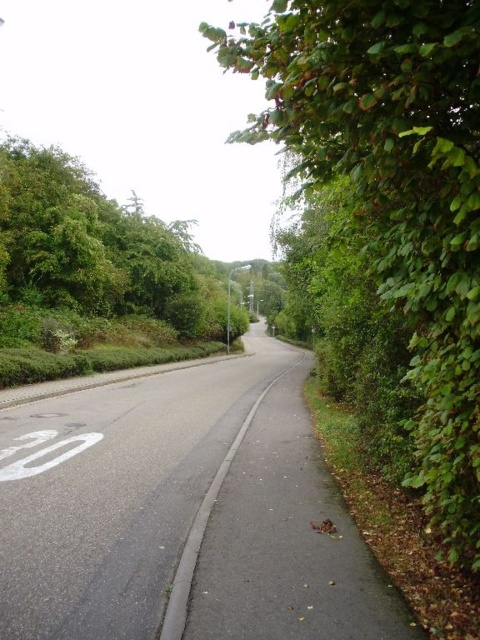
Question: Is green leafy tree at right positioned before green leafy tree at left?

Choices:
 (A) no
 (B) yes

Answer: (B)

Question: Among these objects, which one is nearest to the camera?

Choices:
 (A) green leafy tree at left
 (B) green leafy tree at right

Answer: (B)

Question: Can you confirm if green leafy tree at right is positioned below green leafy tree at left?

Choices:
 (A) yes
 (B) no

Answer: (A)

Question: Which point appears closest to the camera in this image?

Choices:
 (A) (463, 520)
 (B) (118, 285)

Answer: (A)

Question: Which point is closer to the camera?

Choices:
 (A) (6, 205)
 (B) (355, 100)

Answer: (B)

Question: Does green leafy tree at right appear over green leafy tree at left?

Choices:
 (A) no
 (B) yes

Answer: (A)